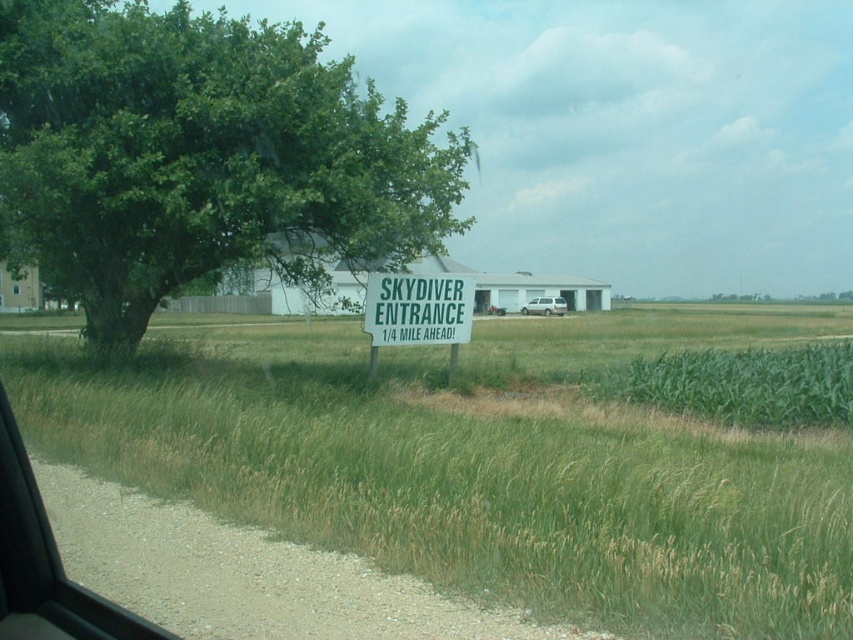
Question: Is green leafy tree at center wider than green leafy corn at right?

Choices:
 (A) yes
 (B) no

Answer: (A)

Question: Which point is farther to the camera?

Choices:
 (A) green leafy corn at right
 (B) green grass at center
 (C) silver metallic van at center
 (D) green leafy tree at center

Answer: (C)

Question: Does green grass at center lie in front of green leafy corn at right?

Choices:
 (A) yes
 (B) no

Answer: (A)

Question: Considering the real-world distances, which object is farthest from the green grass at center?

Choices:
 (A) silver metallic van at center
 (B) white plastic sign at center

Answer: (A)

Question: Which object appears farthest from the camera in this image?

Choices:
 (A) green leafy corn at right
 (B) white plastic sign at center
 (C) green leafy tree at center
 (D) transparent glass car window at lower left

Answer: (B)

Question: Is green grass at center further to camera compared to green leafy corn at right?

Choices:
 (A) no
 (B) yes

Answer: (A)